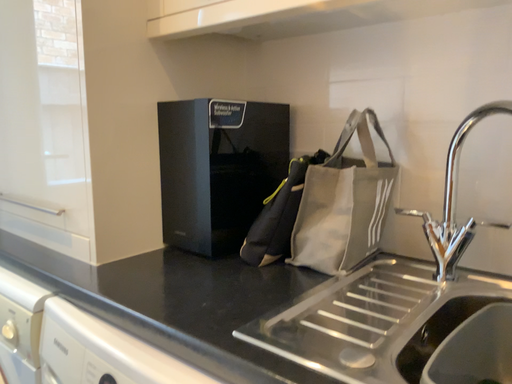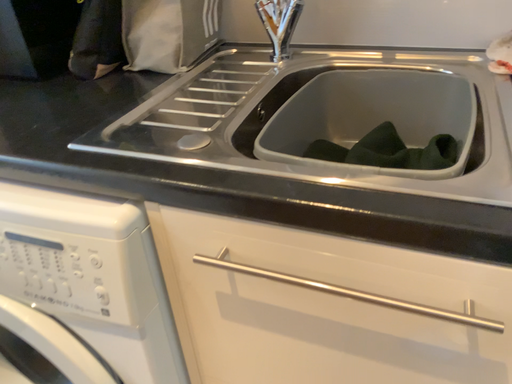
Question: How did the camera likely rotate when shooting the video?

Choices:
 (A) rotated right
 (B) rotated left

Answer: (A)